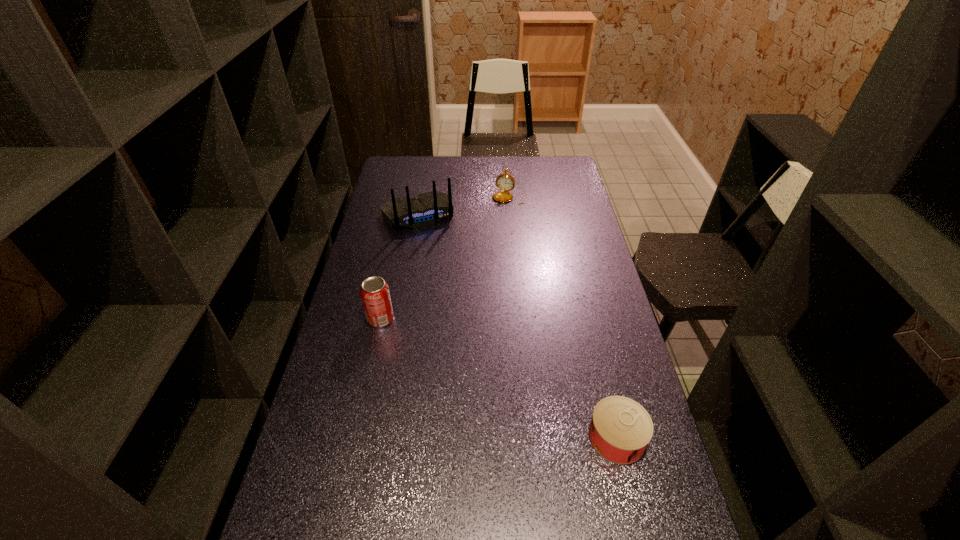
What are the coordinates of `the second tallest object` in the screenshot? It's located at (375, 295).

This screenshot has height=540, width=960. In order to click on the second nearest object in this screenshot , I will do `click(375, 295)`.

I want to click on the nearest object, so click(x=620, y=430).

The image size is (960, 540). In order to click on the rightmost object in this screenshot , I will do `click(620, 430)`.

You are a GUI agent. You are given a task and a screenshot of the screen. Output one action in this format:
    pyautogui.click(x=<x>, y=<y>)
    Task: Click on the tallest object
    
    Given the screenshot: What is the action you would take?
    pyautogui.click(x=425, y=209)

Locate an element on the screen. This screenshot has height=540, width=960. the third tallest object is located at coordinates (505, 182).

Image resolution: width=960 pixels, height=540 pixels. Identify the location of pocket watch. (505, 182).

Identify the location of vacant area situated on the right of the soda can. (428, 319).

Where is `free spot located on the left of the rightmost object`? free spot located on the left of the rightmost object is located at coordinates (452, 437).

Where is `free space located 0.390m on the back of the tallest object`? The height and width of the screenshot is (540, 960). free space located 0.390m on the back of the tallest object is located at coordinates click(x=460, y=299).